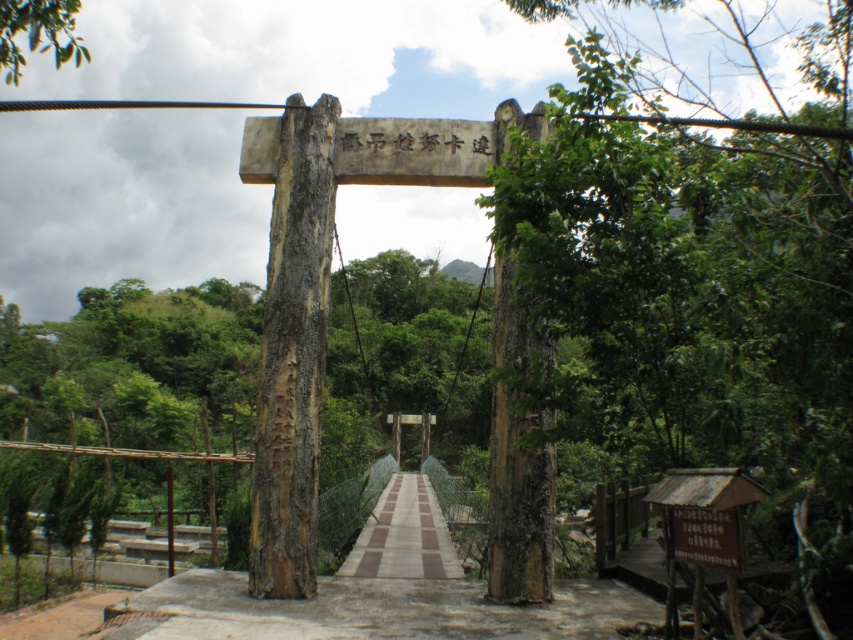
Question: Does brown concrete path at center appear over brown wooden sign at center?

Choices:
 (A) yes
 (B) no

Answer: (B)

Question: Is the position of brown rough wood at upper center more distant than that of green leafy tree at upper left?

Choices:
 (A) yes
 (B) no

Answer: (B)

Question: Can you confirm if brown concrete path at center is positioned below brown wooden sign at center?

Choices:
 (A) yes
 (B) no

Answer: (A)

Question: Considering the real-world distances, which object is farthest from the brown concrete path at center?

Choices:
 (A) brown textured path at center
 (B) green leafy tree at upper left

Answer: (B)

Question: Among these points, which one is farthest from the camera?

Choices:
 (A) (395, 506)
 (B) (10, 22)
 (C) (712, 534)
 (D) (799, 536)

Answer: (A)

Question: Which point is farther to the camera?

Choices:
 (A) brown wooden sign at center
 (B) green leafy tree at upper left
 (C) brown textured path at center

Answer: (C)